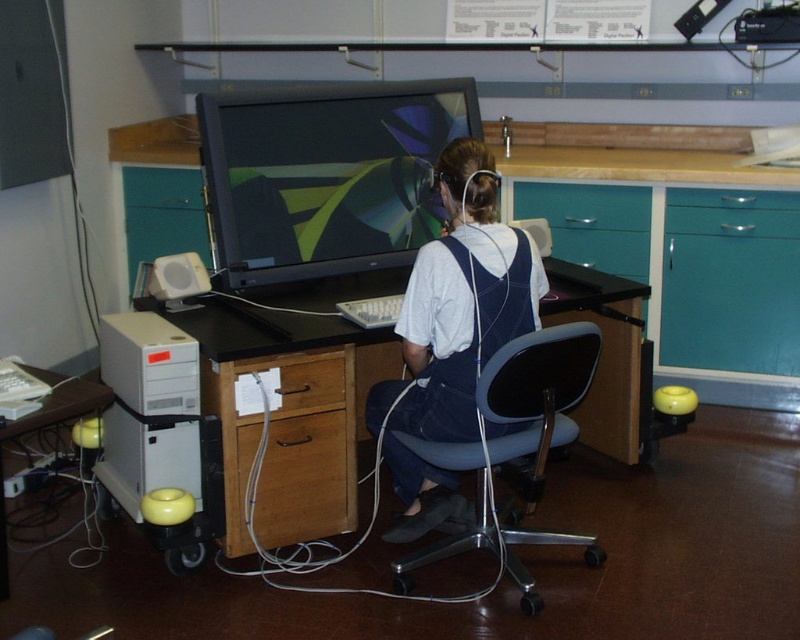
Does wooden drawer at lower center appear under brown wood drawer at lower center?

Correct, wooden drawer at lower center is located below brown wood drawer at lower center.

Measure the distance between wooden drawer at lower center and camera.

8.15 feet

This screenshot has width=800, height=640. Find the location of `wooden drawer at lower center`. wooden drawer at lower center is located at coordinates (306, 480).

Does black wood table at center have a greater height compared to matte black monitor at center?

Yes, black wood table at center is taller than matte black monitor at center.

Does black wood table at center appear on the left side of matte black monitor at center?

Yes, black wood table at center is to the left of matte black monitor at center.

This screenshot has width=800, height=640. What are the coordinates of `black wood table at center` in the screenshot? It's located at (292, 410).

Who is higher up, black wood table at center or white plastic table at lower left?

black wood table at center

Is black wood table at center in front of white plastic table at lower left?

No.

Where is `black wood table at center`? This screenshot has height=640, width=800. black wood table at center is located at coordinates (292, 410).

The image size is (800, 640). Identify the location of black wood table at center. (292, 410).